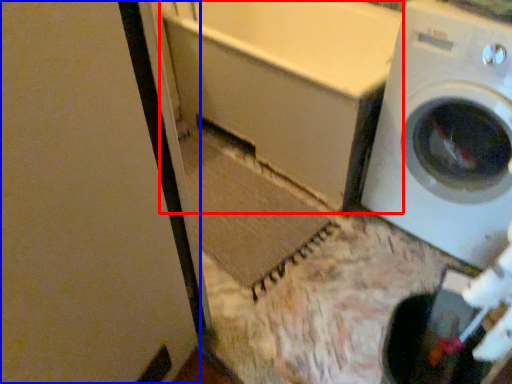
Question: Among these objects, which one is nearest to the camera, bath (highlighted by a red box) or screen door (highlighted by a blue box)?

Choices:
 (A) bath
 (B) screen door

Answer: (B)